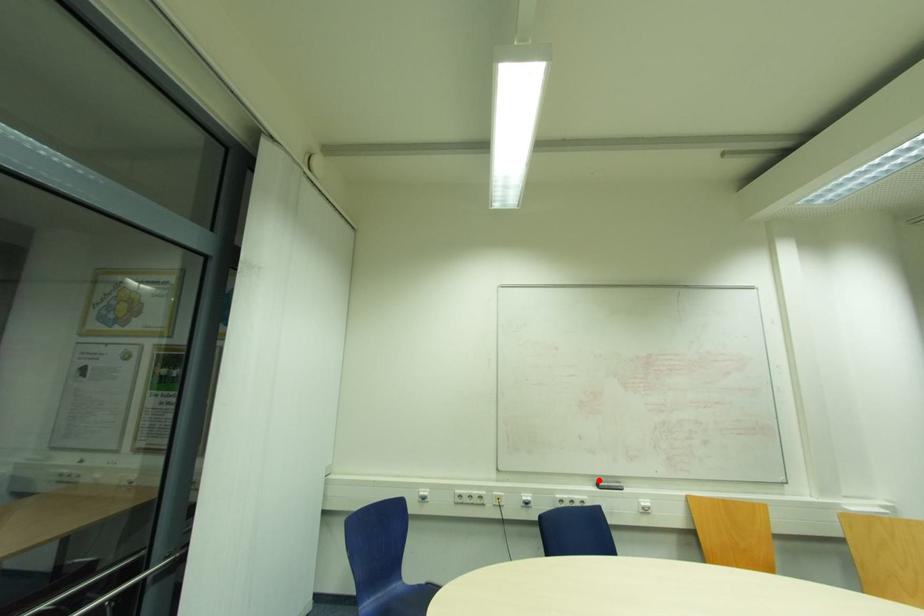
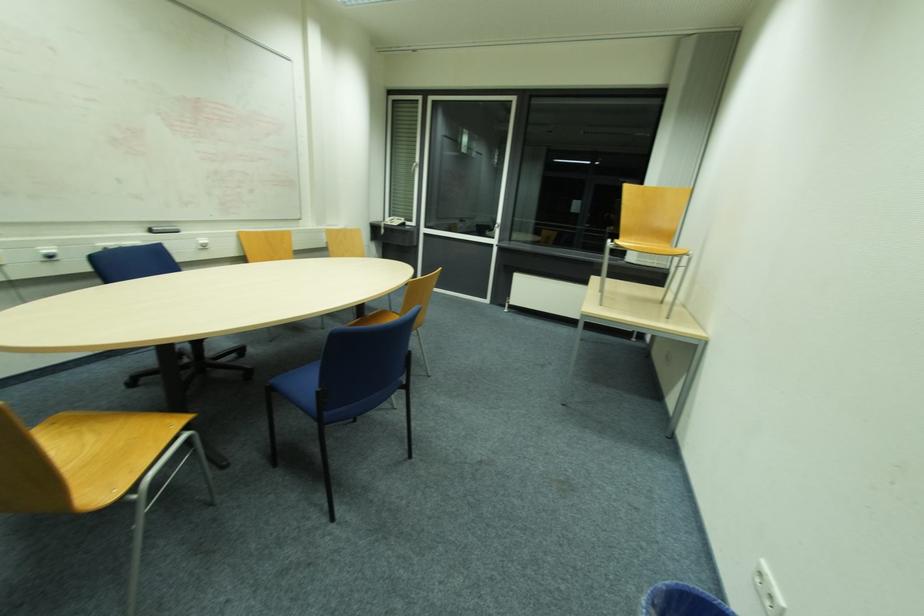
Locate, in the second image, the point that corresponds to the highlighted location in the first image.

(151, 227)